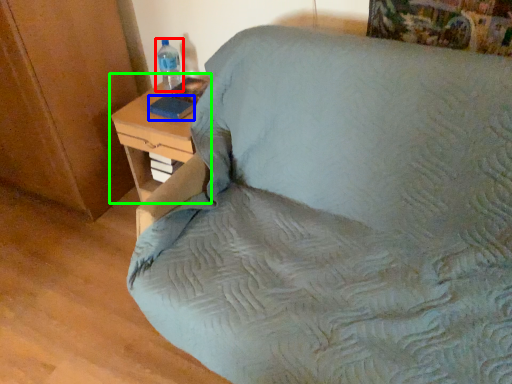
Question: Which object is the farthest from bottle (highlighted by a red box)? Choose among these: pad (highlighted by a blue box) or nightstand (highlighted by a green box).

Choices:
 (A) pad
 (B) nightstand

Answer: (B)